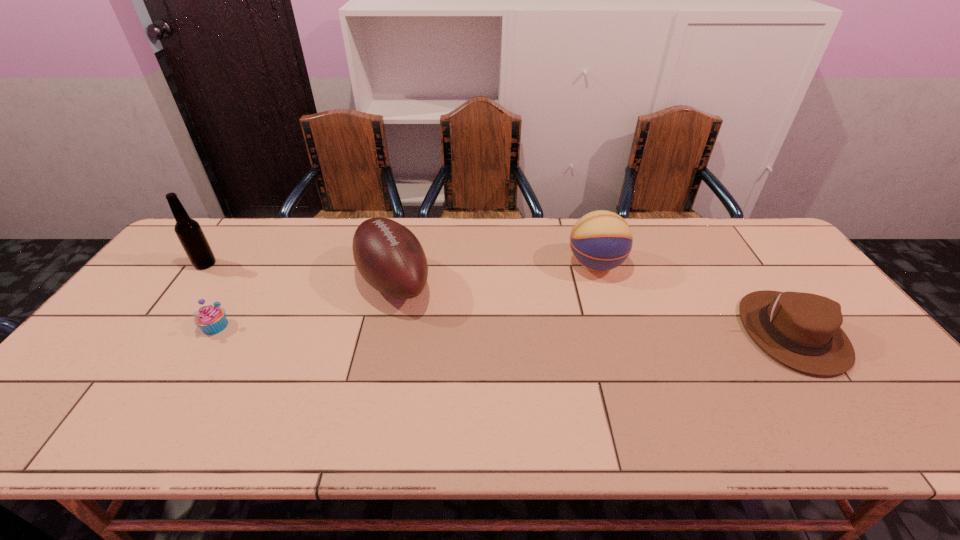
What are the coordinates of `vacant region located on the patterned surface of the fourth object from left to right` in the screenshot? It's located at (453, 265).

The width and height of the screenshot is (960, 540). Identify the location of free space located 0.160m on the patterned surface of the fourth object from left to right. (515, 265).

Find the location of a particular element. The width and height of the screenshot is (960, 540). vacant space located on the patterned surface of the fourth object from left to right is located at coordinates (502, 265).

This screenshot has width=960, height=540. I want to click on free space located on the feather side of the fedora, so (x=850, y=412).

I want to click on free space located on the back of the muffin, so click(x=233, y=296).

You are a GUI agent. You are given a task and a screenshot of the screen. Output one action in this format:
    pyautogui.click(x=<x>, y=<y>)
    Task: Click on the beer bottle situated at the far edge
    
    Given the screenshot: What is the action you would take?
    pyautogui.click(x=191, y=236)

Locate an element on the screen. football (American) situated at the far edge is located at coordinates (389, 257).

The image size is (960, 540). Find the location of `basketball positioned at the far edge`. basketball positioned at the far edge is located at coordinates (601, 240).

Image resolution: width=960 pixels, height=540 pixels. Find the location of `object that is at the left edge`. object that is at the left edge is located at coordinates (191, 236).

Locate an element on the screen. object located in the right edge section of the desktop is located at coordinates (802, 330).